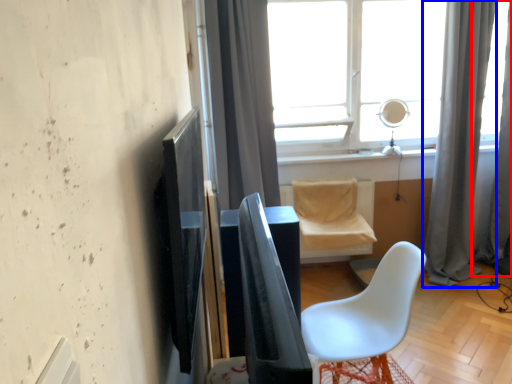
Question: Which object is closer to the camera taking this photo, curtain (highlighted by a red box) or curtain (highlighted by a blue box)?

Choices:
 (A) curtain
 (B) curtain

Answer: (B)